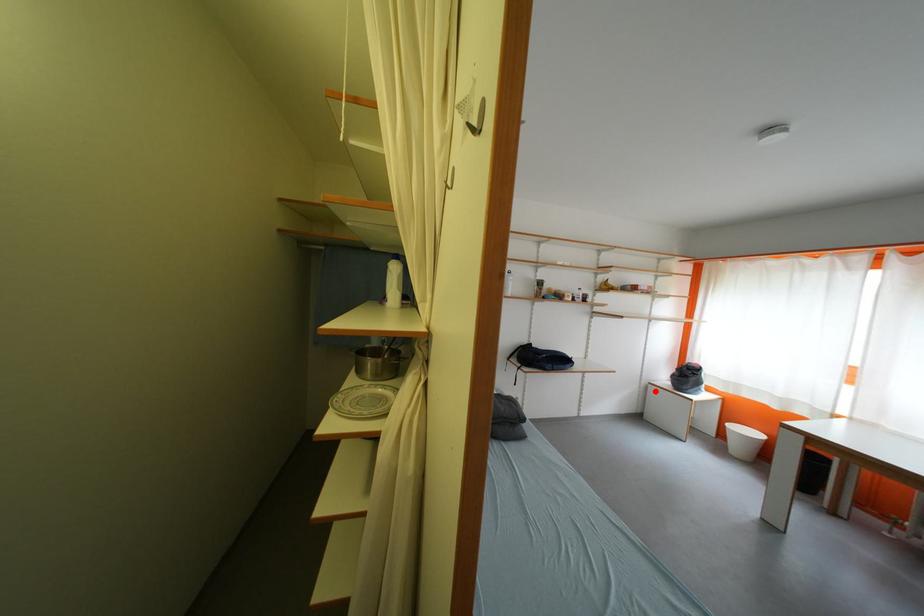
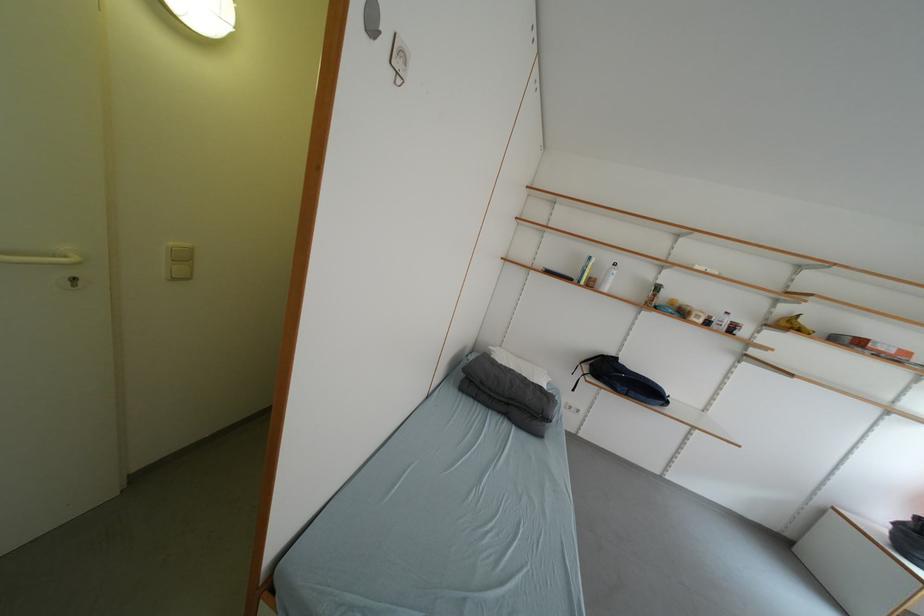
Find the pixel in the second image that matches the highlighted location in the first image.

(832, 515)